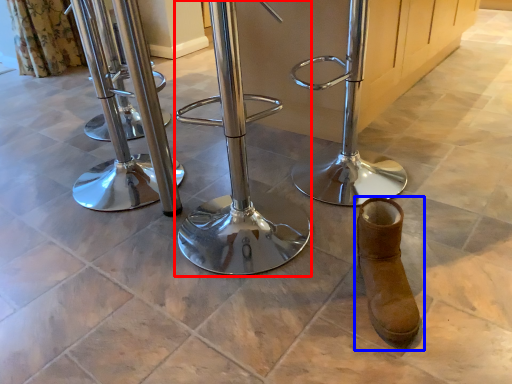
Question: Which point is further to the camera, swivel chair (highlighted by a red box) or footwear (highlighted by a blue box)?

Choices:
 (A) swivel chair
 (B) footwear

Answer: (B)